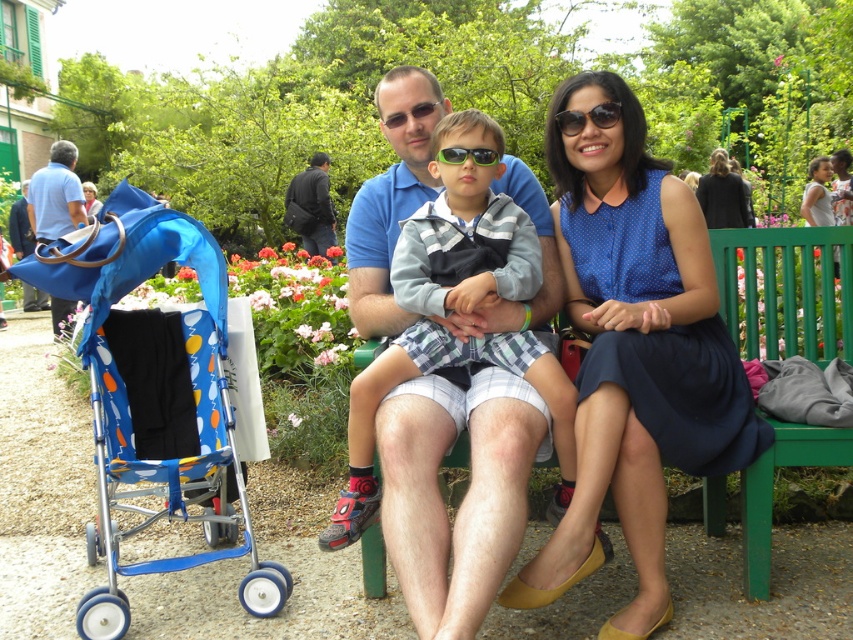
You are standing in the park and see the blue fabric stroller at left and the blue fabric bag at left. Which one is positioned lower from the ground?

The blue fabric stroller at left is positioned below the blue fabric bag at left, so it is lower from the ground.

You are standing in the park and see the blue cotton shirt at center and the blue fabric stroller at left. Which object is higher up in the image?

The blue cotton shirt at center is located above the blue fabric stroller at left, so it is higher up in the image.

You are standing at the point labeled point (54,204) and want to walk to the point labeled point (732,225). According to the scene description, which direction should you face to move towards your destination?

You should face backward because point (54,204) is in front of point (732,225), meaning the destination is behind your current position.